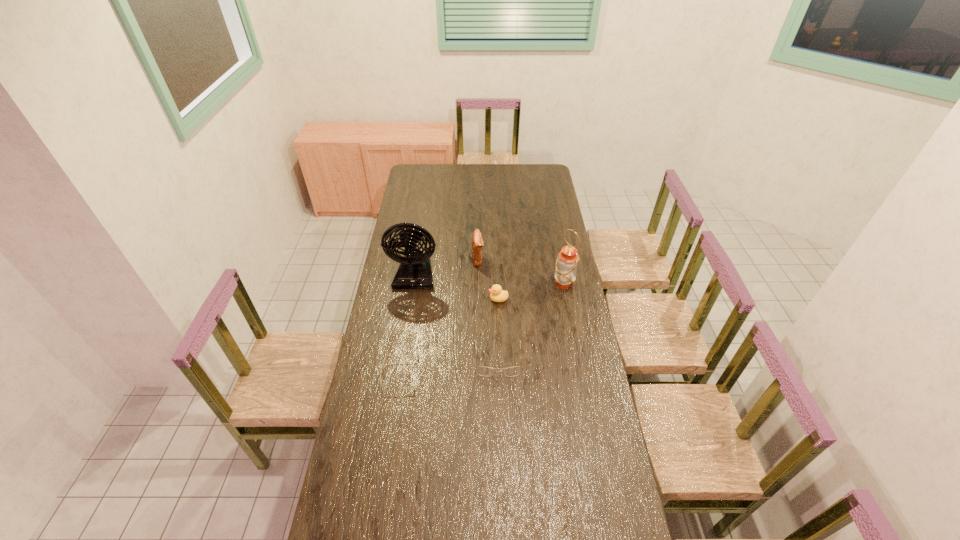
Where is `free point that keeps the spectacless evenly spaced on the right`? The image size is (960, 540). free point that keeps the spectacless evenly spaced on the right is located at coordinates (590, 343).